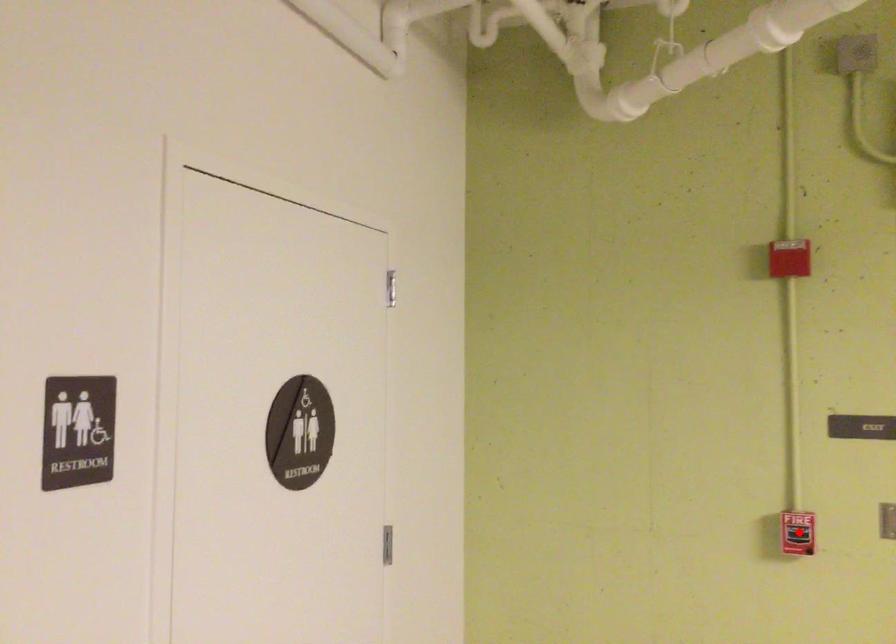
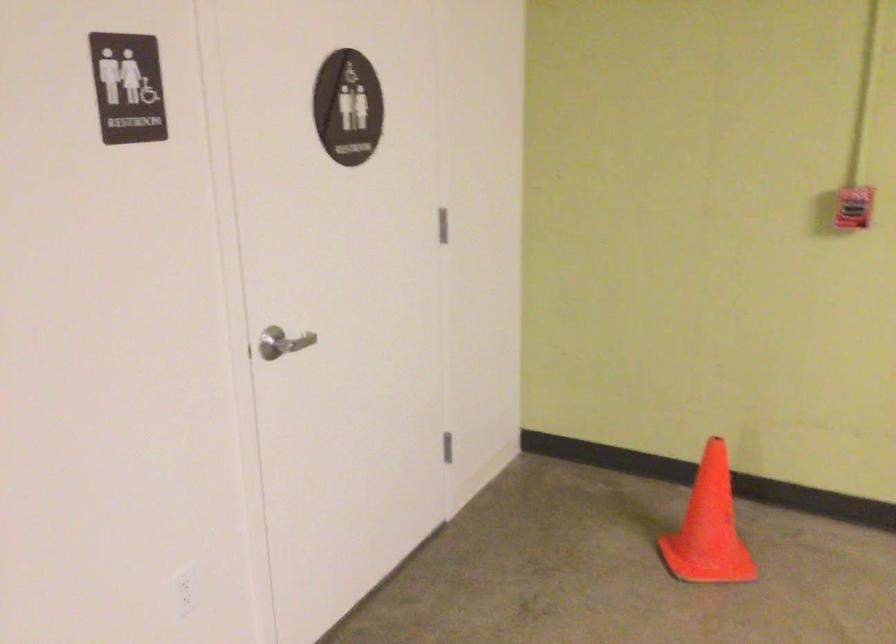
Find the pixel in the second image that matches the highlighted location in the first image.

(854, 207)